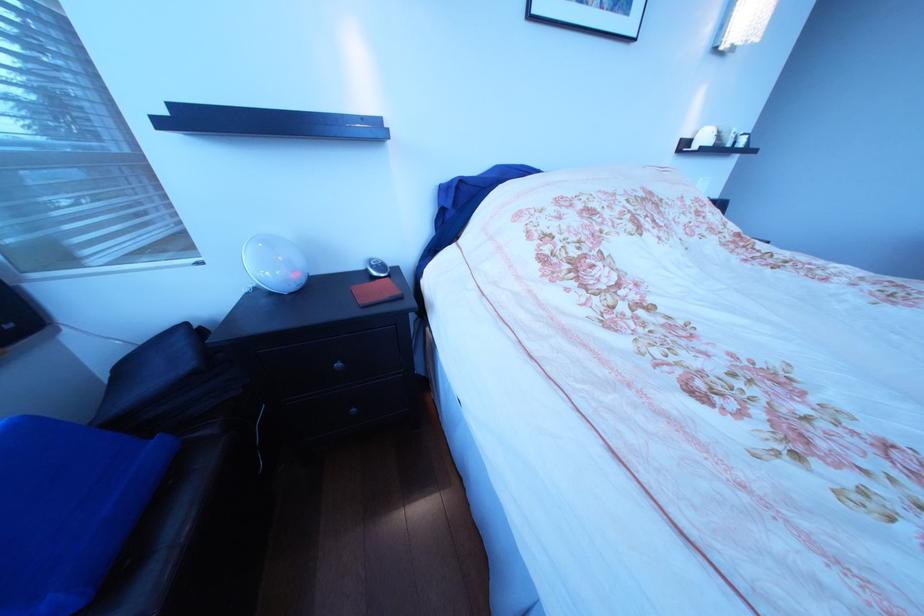
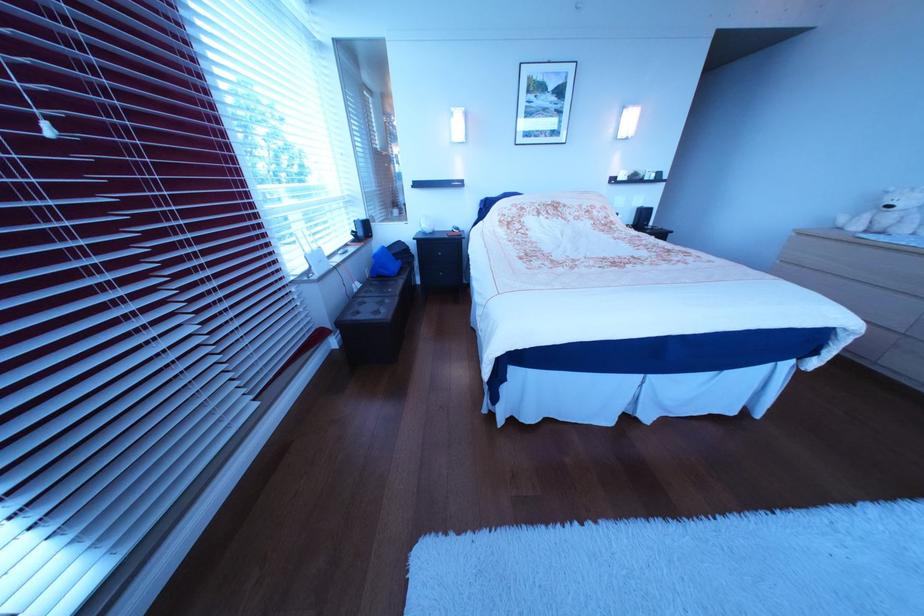
Where in the second image is the point corresponding to pixel 354 368 from the first image?

(456, 256)